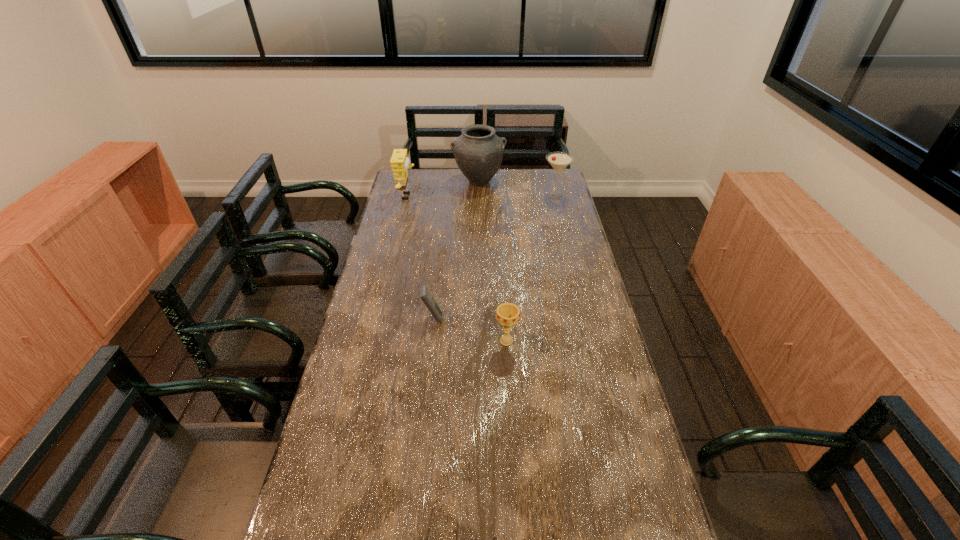
Where is `urn that is at the far edge`? This screenshot has width=960, height=540. urn that is at the far edge is located at coordinates (478, 152).

Where is `sponge that is at the far edge`? The height and width of the screenshot is (540, 960). sponge that is at the far edge is located at coordinates (399, 161).

Locate an element on the screen. martini that is at the far edge is located at coordinates (559, 161).

Identify the location of object at the left edge. (399, 161).

This screenshot has width=960, height=540. In order to click on object situated at the right edge in this screenshot , I will do `click(559, 161)`.

This screenshot has height=540, width=960. Find the location of `object positioned at the far left corner`. object positioned at the far left corner is located at coordinates (399, 161).

What are the coordinates of `object present at the far right corner` in the screenshot? It's located at (559, 161).

Find the location of a particular element. vacant space at the left edge of the desktop is located at coordinates (383, 221).

Locate an element on the screen. The height and width of the screenshot is (540, 960). free space at the right edge of the desktop is located at coordinates (563, 216).

Identify the location of empty location between the second nearest object and the sponge. (457, 269).